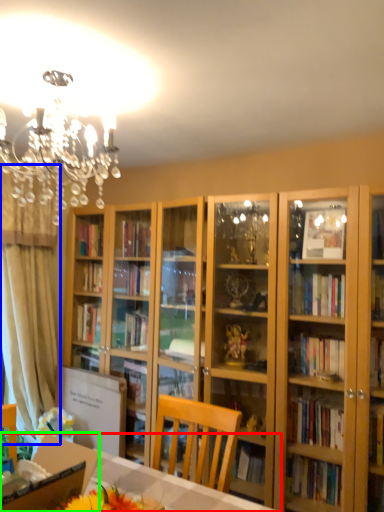
Question: Estimate the real-world distances between objects in this image. Which object is closer to desk (highlighted by a red box), curtain (highlighted by a blue box) or cardboard box (highlighted by a green box)?

Choices:
 (A) curtain
 (B) cardboard box

Answer: (B)